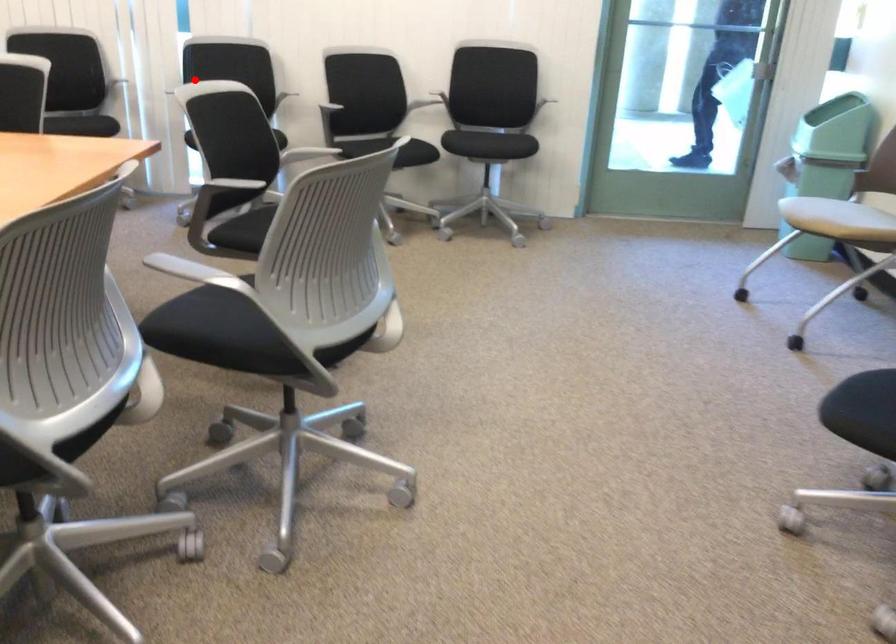
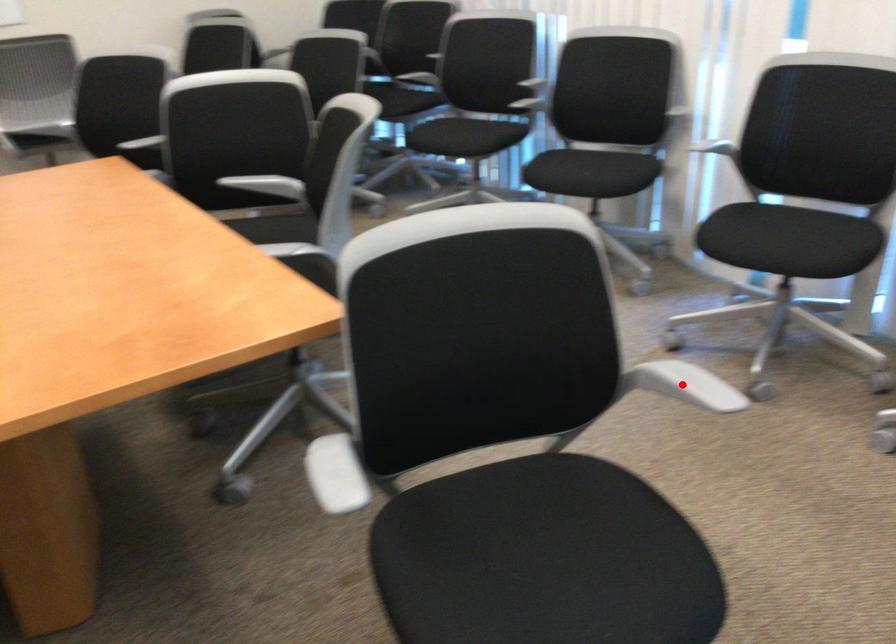
I am providing you with two images of the same scene from different viewpoints. A red point is marked on the first image and another point is marked on the second image. Do the highlighted points in image1 and image2 indicate the same real-world spot?

No